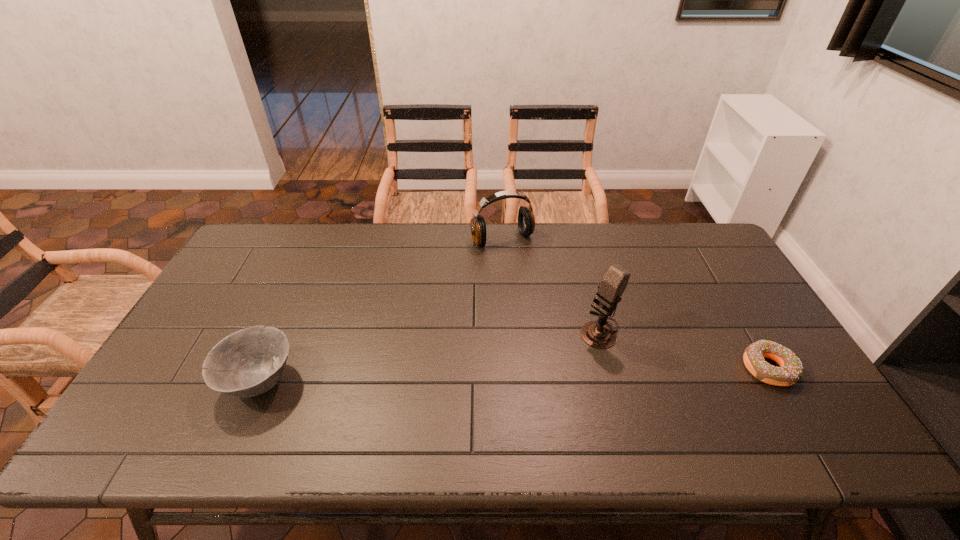
Where is `empty location between the bowl and the third object from right to left`? The width and height of the screenshot is (960, 540). empty location between the bowl and the third object from right to left is located at coordinates (381, 310).

You are a GUI agent. You are given a task and a screenshot of the screen. Output one action in this format:
    pyautogui.click(x=<x>, y=<y>)
    Task: Click on the vacant point located between the headset and the rightmost object
    The image size is (960, 540).
    Given the screenshot: What is the action you would take?
    pyautogui.click(x=636, y=304)

Where is `free space between the bowl and the third shortest object`? This screenshot has height=540, width=960. free space between the bowl and the third shortest object is located at coordinates (381, 310).

This screenshot has width=960, height=540. In order to click on unoccupied position between the headset and the leftmost object in this screenshot , I will do `click(381, 310)`.

Find the location of a particular element. The height and width of the screenshot is (540, 960). vacant area that lies between the leftmost object and the shortest object is located at coordinates (515, 375).

Locate an element on the screen. Image resolution: width=960 pixels, height=540 pixels. vacant area between the tallest object and the rightmost object is located at coordinates 684,349.

Where is `unoccupied area between the third object from left to right and the farthest object`? Image resolution: width=960 pixels, height=540 pixels. unoccupied area between the third object from left to right and the farthest object is located at coordinates (551, 285).

The height and width of the screenshot is (540, 960). I want to click on object that ranks as the second closest to the leftmost object, so click(x=599, y=334).

The width and height of the screenshot is (960, 540). Find the location of `object that is the third closest one to the second object from right to left`. object that is the third closest one to the second object from right to left is located at coordinates (249, 362).

Where is `vacant position in the image that satisfies the following two spatial constraints: 1. on the front side of the doughnut; 2. on the left side of the third object from right to left`? vacant position in the image that satisfies the following two spatial constraints: 1. on the front side of the doughnut; 2. on the left side of the third object from right to left is located at coordinates (510, 369).